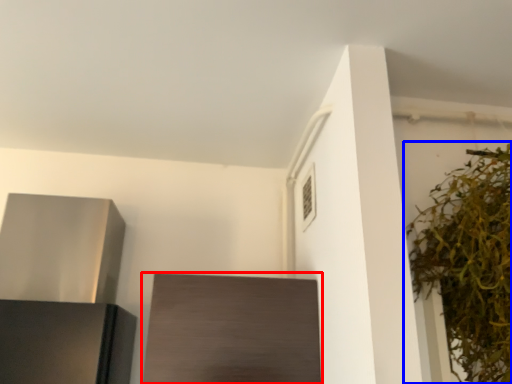
Question: Which of the following is the closest to the observer, cabinetry (highlighted by a red box) or houseplant (highlighted by a blue box)?

Choices:
 (A) cabinetry
 (B) houseplant

Answer: (B)